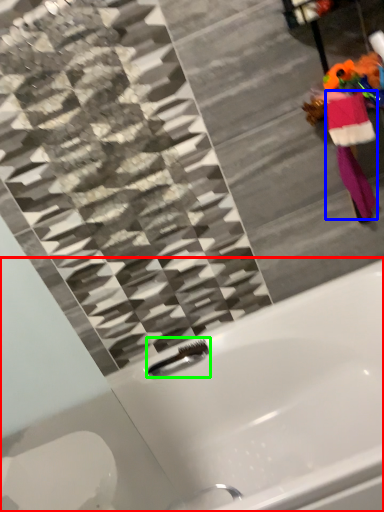
Question: Which object is the closest to the bathtub (highlighted by a red box)? Choose among these: robe (highlighted by a blue box) or faucet (highlighted by a green box).

Choices:
 (A) robe
 (B) faucet

Answer: (B)